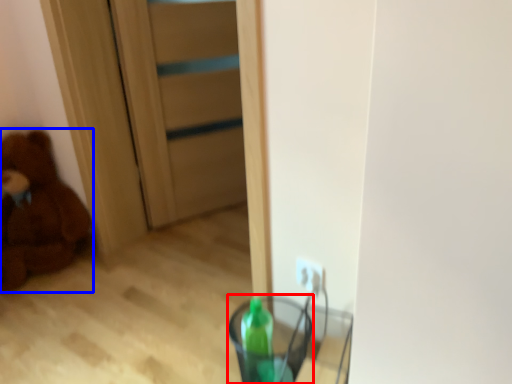
Question: Which point is further to the camera, glass vase (highlighted by a red box) or teddy bear (highlighted by a blue box)?

Choices:
 (A) glass vase
 (B) teddy bear

Answer: (B)